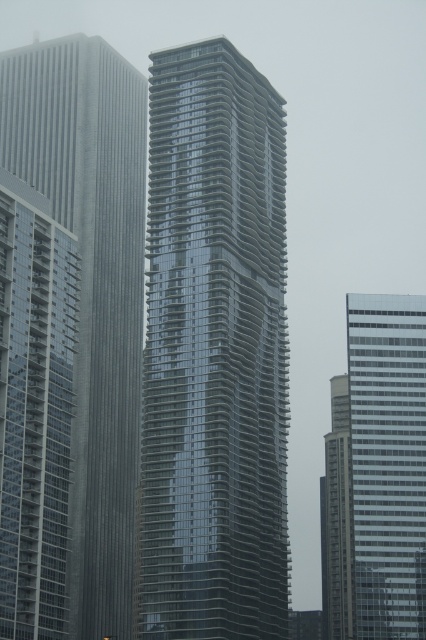
From the picture: You are an architect evaluating the city skyline. You notice the reflective glass skyscraper at left and the clear glass skyscraper at right. Which of these two buildings would cast a larger shadow given their sizes and positions?

The reflective glass skyscraper at left is larger in size than the clear glass skyscraper at right, so it would cast a larger shadow.

structural engineer is standing at the base of the central skyscraper and wants to reach the point at coordinates point (13, 106). The engineer has a drone that can fly up to 150 meters. Will the drone be able to reach the point?

structural engineer is standing at the base of the central skyscraper and wants to reach the point at coordinates point (13, 106). The engineer has a drone that can fly up to 150 meters. The point (13, 106) is 156.12 meters from viewer. Therefore, the drone cannot reach the point as it exceeds its maximum range of 150 meters.